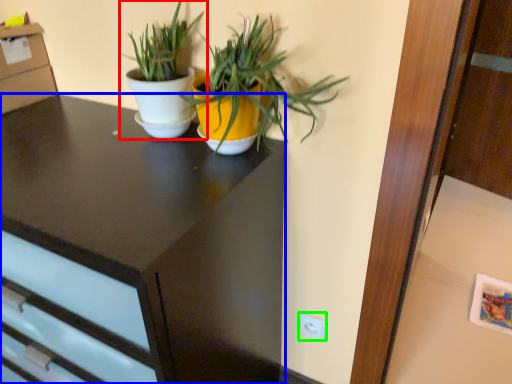
Question: Based on their relative distances, which object is farther from houseplant (highlighted by a red box)? Choose from desk (highlighted by a blue box) and electric outlet (highlighted by a green box).

Choices:
 (A) desk
 (B) electric outlet

Answer: (B)